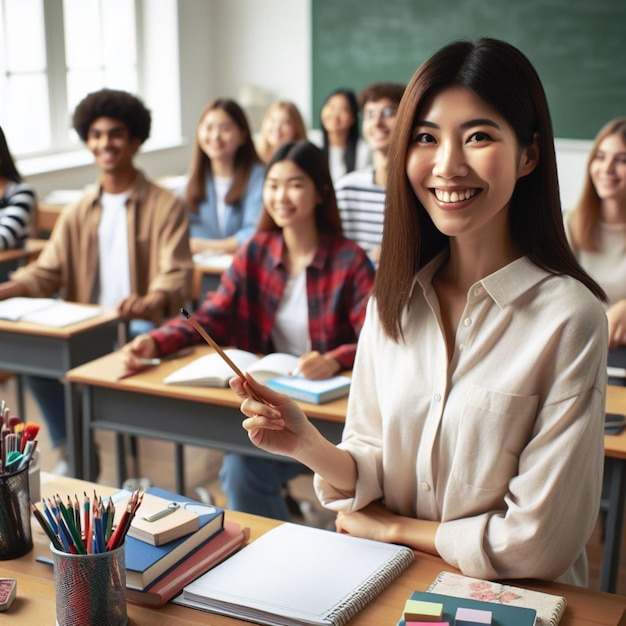
This screenshot has width=626, height=626. In order to click on pencil cup in this screenshot , I will do `click(84, 568)`.